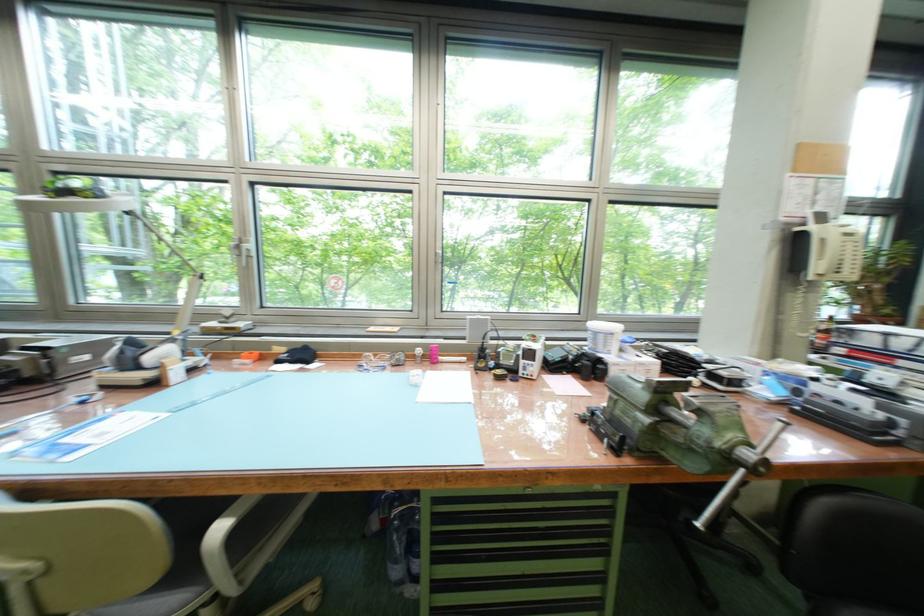
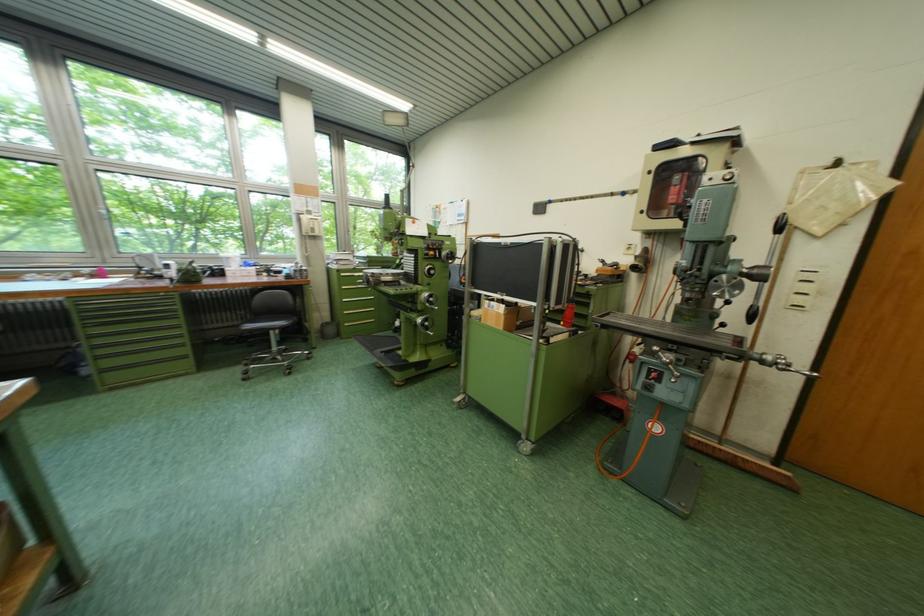
Locate, in the second image, the point that corresponds to (x=455, y=318) in the first image.

(132, 257)